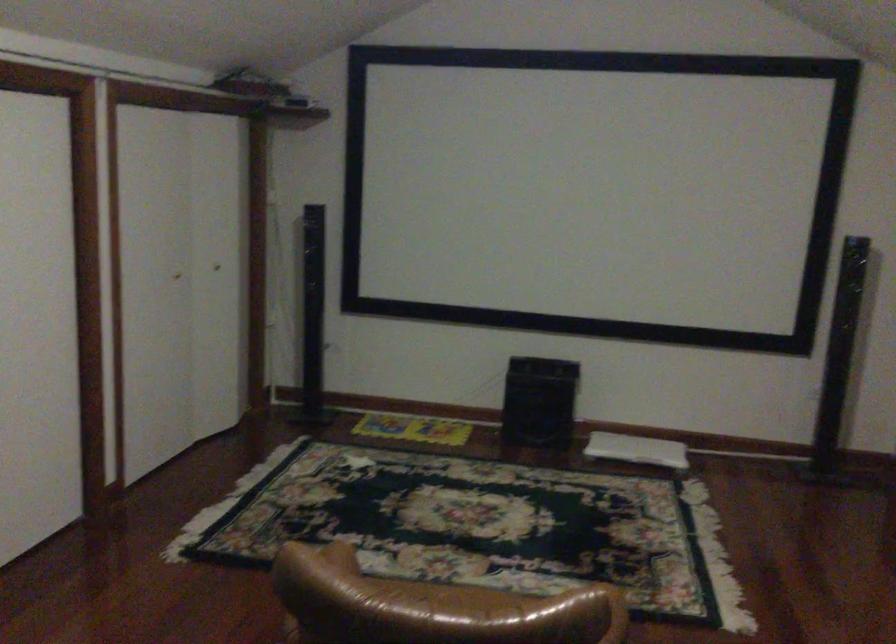
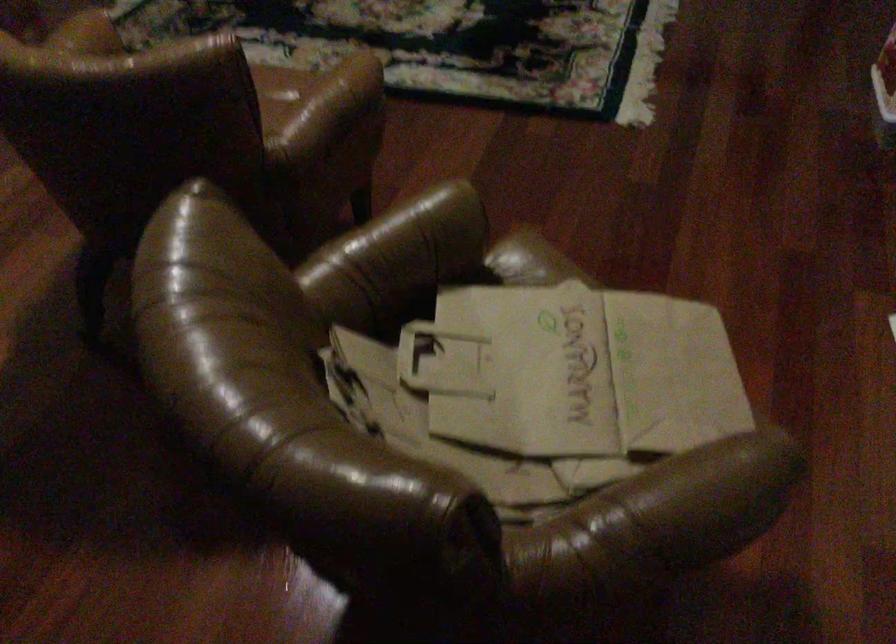
Question: How did the camera likely rotate?

Choices:
 (A) Left
 (B) Right
 (C) Up
 (D) Down

Answer: (D)